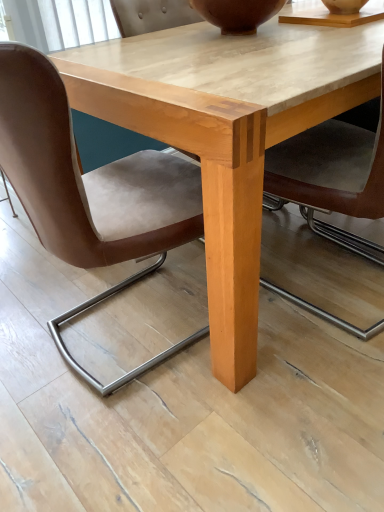
Question: From the image's perspective, does brown matte vase at upper center appear higher than brown leather chair at lower left?

Choices:
 (A) no
 (B) yes

Answer: (B)

Question: Considering the relative positions of brown matte vase at upper center and brown leather chair at lower left in the image provided, is brown matte vase at upper center to the left of brown leather chair at lower left from the viewer's perspective?

Choices:
 (A) yes
 (B) no

Answer: (B)

Question: Does brown matte vase at upper center have a lesser width compared to brown leather chair at lower left?

Choices:
 (A) yes
 (B) no

Answer: (A)

Question: Is brown matte vase at upper center facing towards brown leather chair at lower left?

Choices:
 (A) yes
 (B) no

Answer: (B)

Question: Is brown matte vase at upper center outside brown leather chair at lower left?

Choices:
 (A) no
 (B) yes

Answer: (B)

Question: Considering the relative sizes of brown matte vase at upper center and brown leather chair at lower left in the image provided, is brown matte vase at upper center bigger than brown leather chair at lower left?

Choices:
 (A) yes
 (B) no

Answer: (B)

Question: Could you tell me if brown matte vase at upper center is turned towards light wood table at center?

Choices:
 (A) no
 (B) yes

Answer: (A)

Question: From the image's perspective, is brown matte vase at upper center on light wood table at center?

Choices:
 (A) yes
 (B) no

Answer: (A)

Question: From a real-world perspective, is brown matte vase at upper center positioned under light wood table at center based on gravity?

Choices:
 (A) no
 (B) yes

Answer: (A)

Question: Considering the relative positions of brown matte vase at upper center and light wood table at center in the image provided, is brown matte vase at upper center to the left of light wood table at center from the viewer's perspective?

Choices:
 (A) yes
 (B) no

Answer: (A)

Question: Is brown matte vase at upper center oriented away from light wood table at center?

Choices:
 (A) yes
 (B) no

Answer: (B)

Question: Does brown matte vase at upper center have a lesser width compared to light wood table at center?

Choices:
 (A) no
 (B) yes

Answer: (B)

Question: Is brown leather chair at lower left bigger than light wood table at center?

Choices:
 (A) yes
 (B) no

Answer: (B)